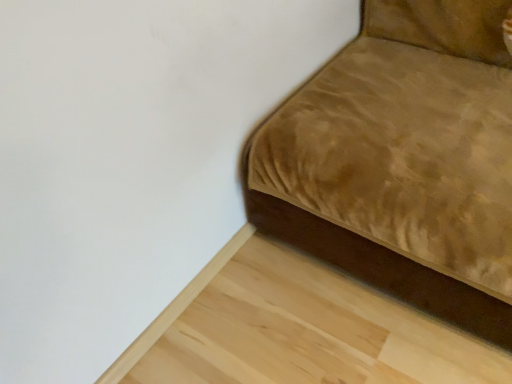
This screenshot has width=512, height=384. What do you see at coordinates (403, 161) in the screenshot?
I see `suede-like brown couch at lower right` at bounding box center [403, 161].

This screenshot has height=384, width=512. What are the coordinates of `suede-like brown couch at lower right` in the screenshot? It's located at (403, 161).

Where is `suede-like brown couch at lower right`? This screenshot has height=384, width=512. suede-like brown couch at lower right is located at coordinates (403, 161).